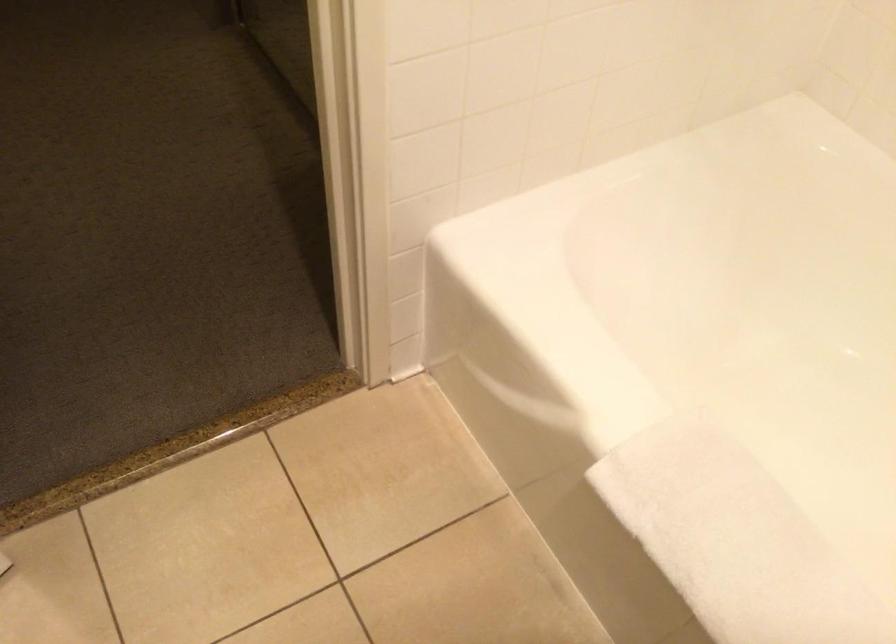
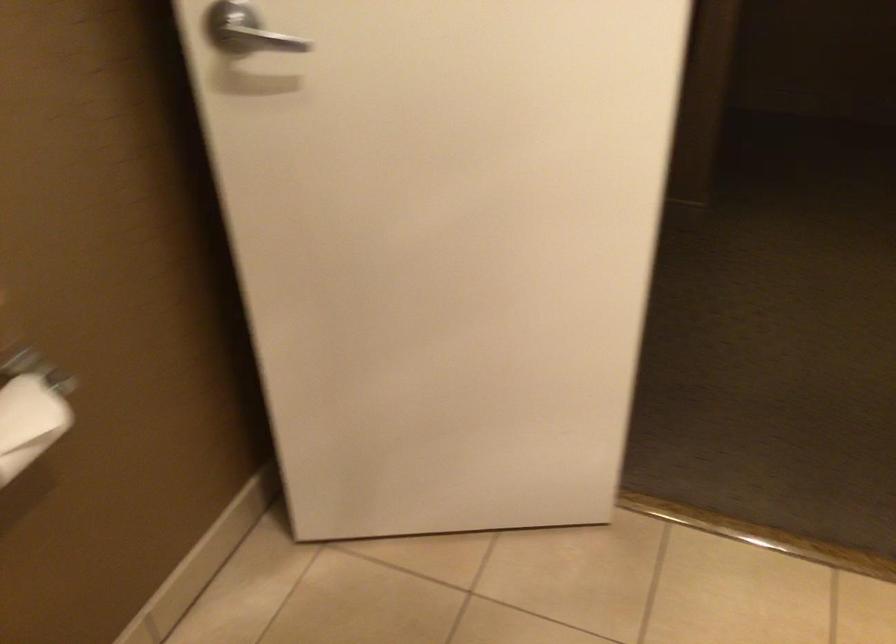
Question: Based on the continuous images, in which direction is the camera rotating? Reply with the corresponding letter.

Choices:
 (A) Left
 (B) Right
 (C) Up
 (D) Down

Answer: (A)